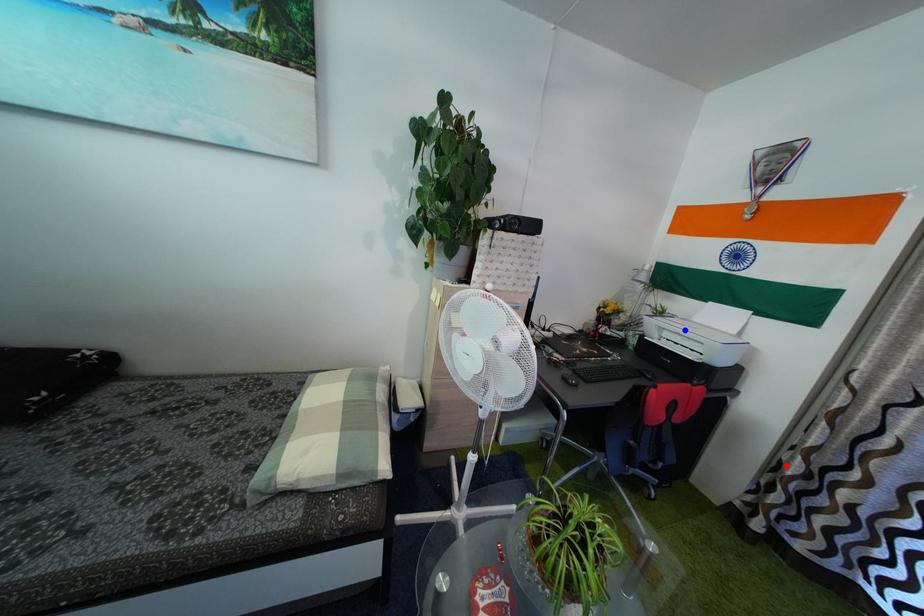
Question: In the image, two points are highlighted. Which point is nearer to the camera? Reply with the corresponding letter.

Choices:
 (A) blue point
 (B) red point

Answer: (B)